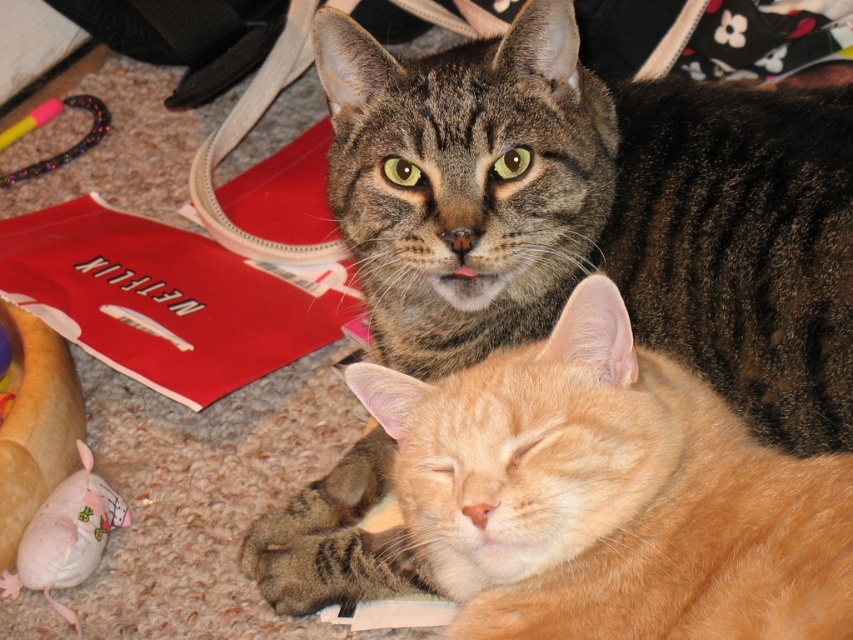
Can you confirm if tabby fur cat at upper center is shorter than pink fabric mouse at lower left?

No, tabby fur cat at upper center is not shorter than pink fabric mouse at lower left.

Is tabby fur cat at upper center above pink fabric mouse at lower left?

Correct, tabby fur cat at upper center is located above pink fabric mouse at lower left.

Who is more forward, (656, 136) or (106, 528)?

Point (656, 136) is more forward.

Where is `tabby fur cat at upper center`? The height and width of the screenshot is (640, 853). tabby fur cat at upper center is located at coordinates (596, 212).